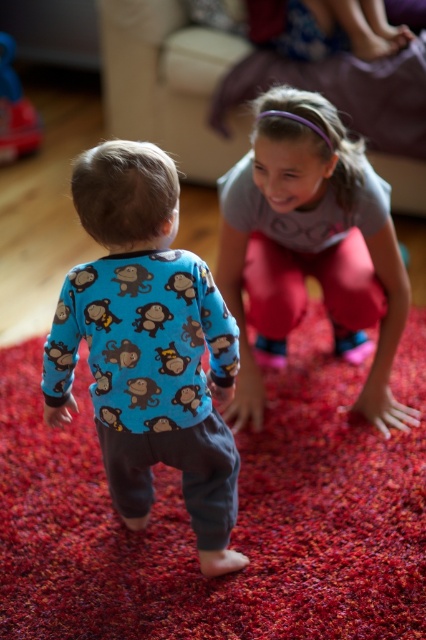
Who is more distant from viewer, (97, 282) or (403, 305)?

The point (403, 305) is behind.

Is blue printed pajamas at center closer to camera compared to matte gray shirt at center?

That is True.

Is point (184, 429) farther from camera compared to point (333, 301)?

No, (184, 429) is closer to viewer.

I want to click on blue printed pajamas at center, so pos(147,346).

Is matte gray shirt at center to the left of rubber duck at left from the viewer's perspective?

In fact, matte gray shirt at center is to the right of rubber duck at left.

Does matte gray shirt at center have a larger size compared to rubber duck at left?

Indeed, matte gray shirt at center has a larger size compared to rubber duck at left.

Is point (357, 248) closer to viewer compared to point (32, 113)?

Yes, it is.

You are a GUI agent. You are given a task and a screenshot of the screen. Output one action in this format:
    pyautogui.click(x=<x>, y=<y>)
    Task: Click on the matte gray shirt at center
    
    Given the screenshot: What is the action you would take?
    pyautogui.click(x=310, y=246)

Can you confirm if blue printed pajamas at center is positioned below rubber duck at left?

Indeed, blue printed pajamas at center is positioned under rubber duck at left.

Is blue printed pajamas at center behind rubber duck at left?

No, blue printed pajamas at center is in front of rubber duck at left.

Identify the location of blue printed pajamas at center. This screenshot has height=640, width=426. (147, 346).